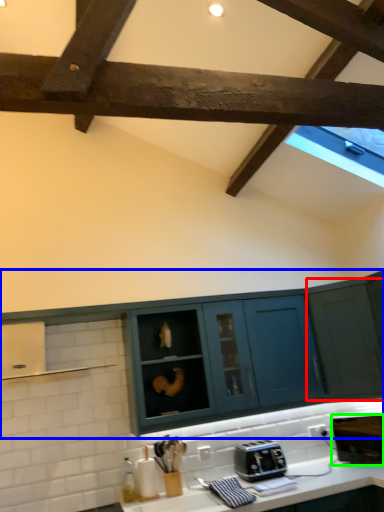
Question: Which object is the farthest from cabinetry (highlighted by a red box)? Choose among these: cabinetry (highlighted by a blue box) or appliance (highlighted by a green box).

Choices:
 (A) cabinetry
 (B) appliance

Answer: (B)